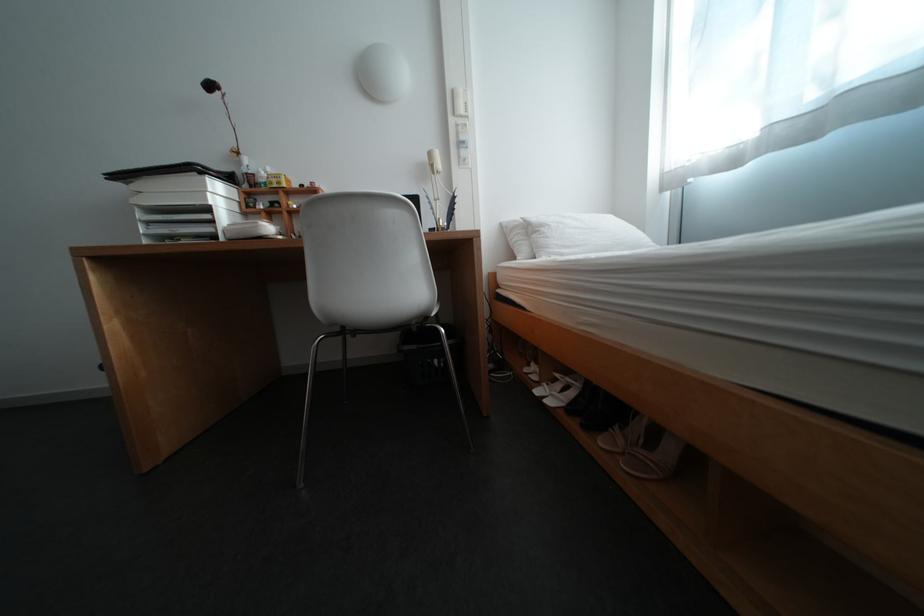
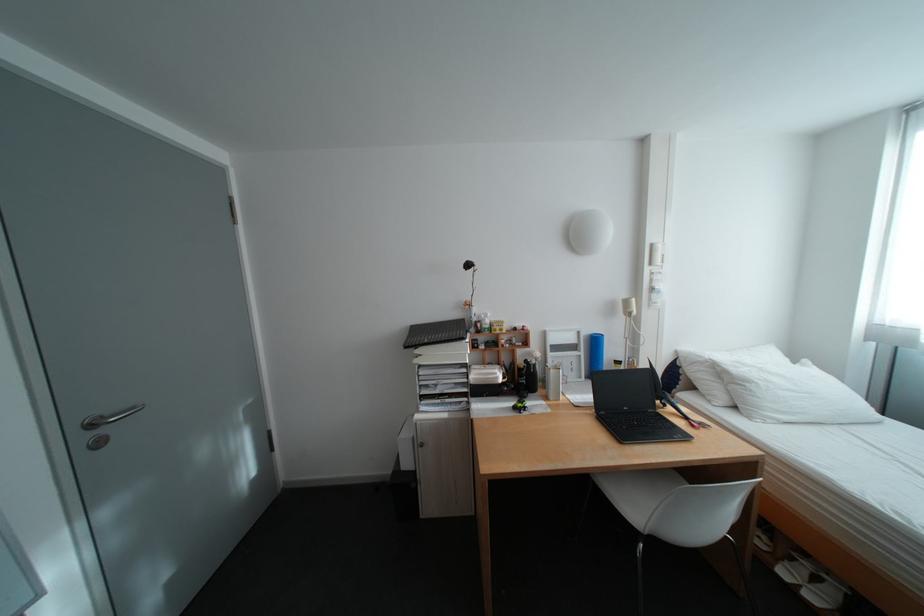
Find the pixel in the second image that matches (x=555, y=228) in the first image.

(761, 384)